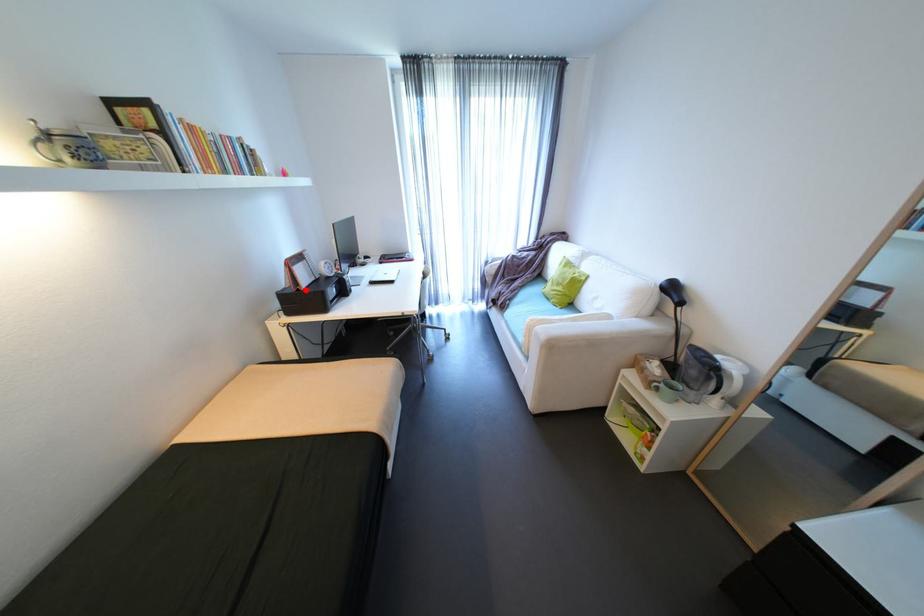
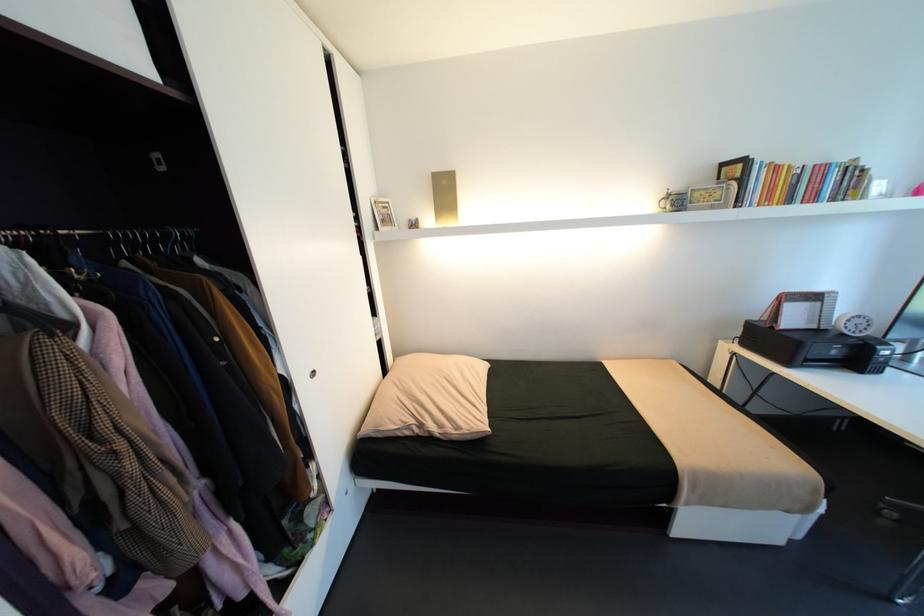
The point at the highlighted location is marked in the first image. Where is the corresponding point in the second image?

(779, 328)